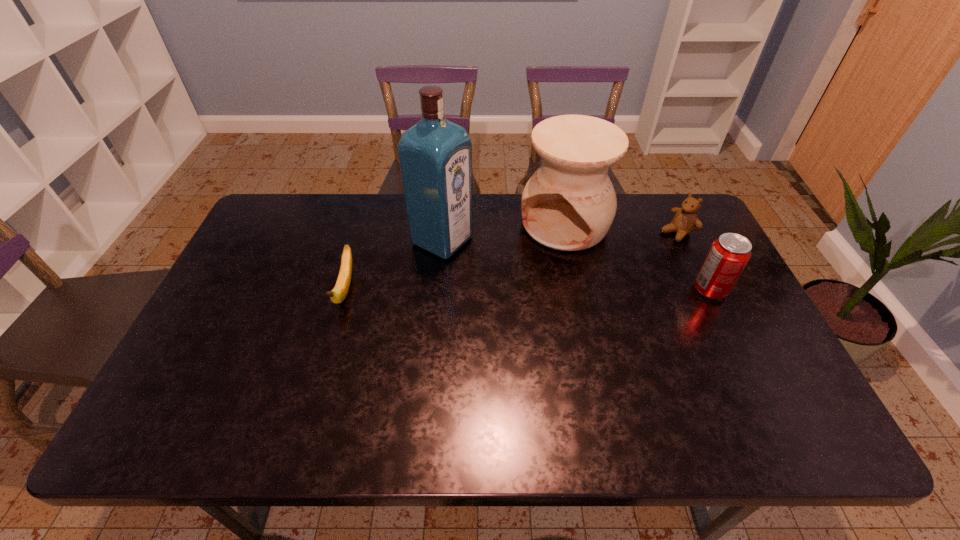
Find the location of a particular element. The width and height of the screenshot is (960, 540). free space between the second shortest object and the soda is located at coordinates (693, 261).

Where is `free space that is in between the third shortest object and the second tallest object`? free space that is in between the third shortest object and the second tallest object is located at coordinates (637, 257).

Identify the location of unoccupied position between the fourth tallest object and the third object from right to left. The image size is (960, 540). (620, 228).

What are the coordinates of `free space that is in between the third object from right to left and the liquor` in the screenshot? It's located at (503, 233).

You are a GUI agent. You are given a task and a screenshot of the screen. Output one action in this format:
    pyautogui.click(x=<x>, y=<y>)
    Task: Click on the empty space between the fourth shortest object and the third shortest object
    This screenshot has height=540, width=960.
    Given the screenshot: What is the action you would take?
    pyautogui.click(x=637, y=257)

The width and height of the screenshot is (960, 540). Identify the location of unoccupied position between the third tallest object and the pottery. (637, 257).

Image resolution: width=960 pixels, height=540 pixels. I want to click on free spot between the pottery and the leftmost object, so click(455, 258).

You are a GUI agent. You are given a task and a screenshot of the screen. Output one action in this format:
    pyautogui.click(x=<x>, y=<y>)
    Task: Click on the vacant space that is in between the fourth object from right to left and the fourth shortest object
    
    Given the screenshot: What is the action you would take?
    pyautogui.click(x=503, y=233)

Identify the location of vacant region between the second object from left to right and the soda. The height and width of the screenshot is (540, 960). (576, 265).

Locate which object is the closest to the banana. Please provide its 2D coordinates. Your answer should be formatted as a tuple, i.e. [(x, y)], where the tuple contains the x and y coordinates of a point satisfying the conditions above.

[(435, 155)]